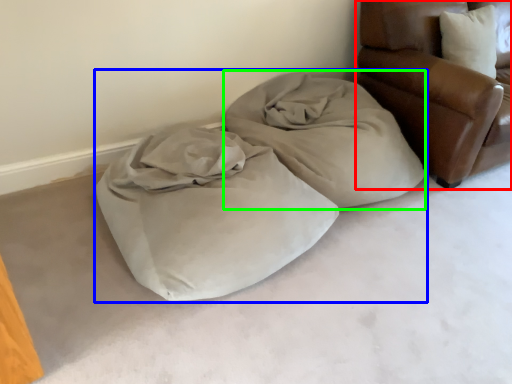
Question: Estimate the real-world distances between objects in this image. Which object is farther from furniture (highlighted by a red box), bed (highlighted by a blue box) or cloth (highlighted by a green box)?

Choices:
 (A) bed
 (B) cloth

Answer: (A)